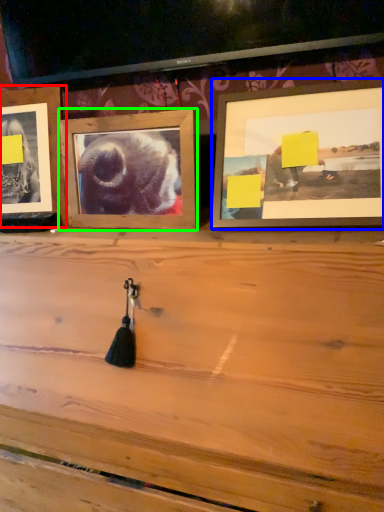
Question: Which object is the farthest from picture frame (highlighted by a red box)? Choose among these: picture frame (highlighted by a blue box) or picture frame (highlighted by a green box).

Choices:
 (A) picture frame
 (B) picture frame

Answer: (A)